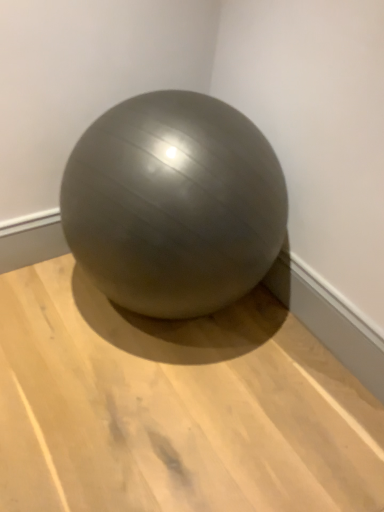
Locate an element on the screen. The width and height of the screenshot is (384, 512). matte gray ball at center is located at coordinates (175, 407).

What do you see at coordinates (175, 407) in the screenshot? Image resolution: width=384 pixels, height=512 pixels. I see `matte gray ball at center` at bounding box center [175, 407].

At what (x,y) coordinates should I click in order to perform the action: click on matte gray ball at center. Please return your answer as a coordinate pair (x, y). This screenshot has height=512, width=384. Looking at the image, I should click on 175,407.